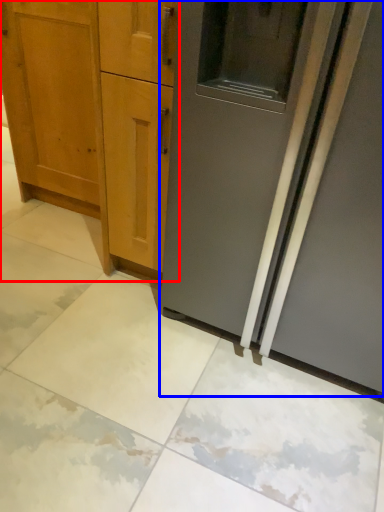
Question: Which object appears farthest to the camera in this image, cabinetry (highlighted by a red box) or door (highlighted by a blue box)?

Choices:
 (A) cabinetry
 (B) door

Answer: (A)